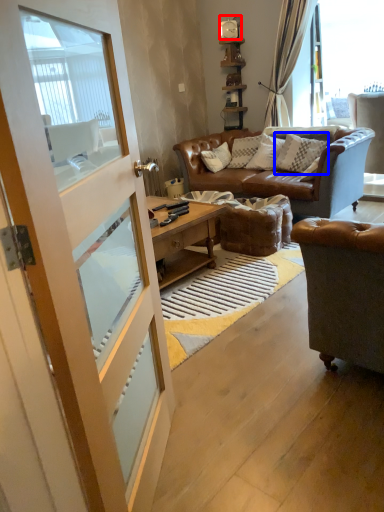
Question: Which point is further to the camera, clock (highlighted by a red box) or pillow (highlighted by a blue box)?

Choices:
 (A) clock
 (B) pillow

Answer: (A)